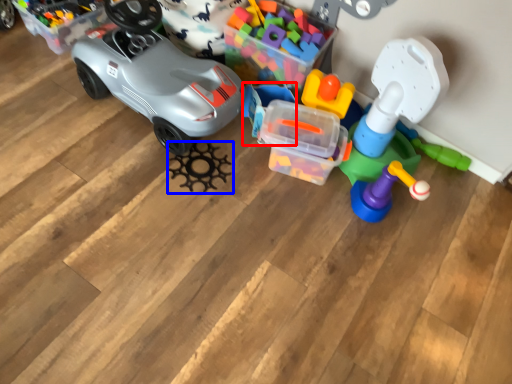
Question: Which object appears closest to the camera in this image, toy (highlighted by a red box) or toy (highlighted by a blue box)?

Choices:
 (A) toy
 (B) toy

Answer: (B)